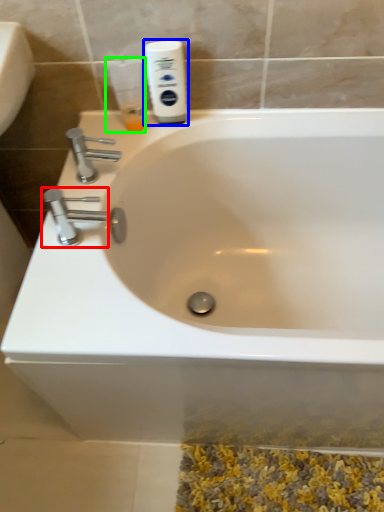
Question: Based on their relative distances, which object is farther from tap (highlighted by a red box)? Choose from shaving cream (highlighted by a blue box) and mouthwash (highlighted by a green box).

Choices:
 (A) shaving cream
 (B) mouthwash

Answer: (A)